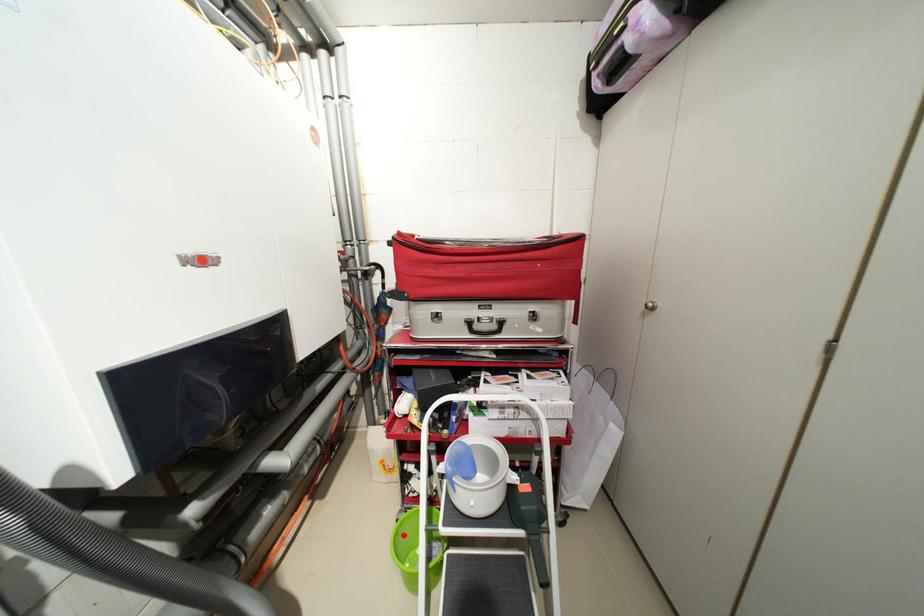
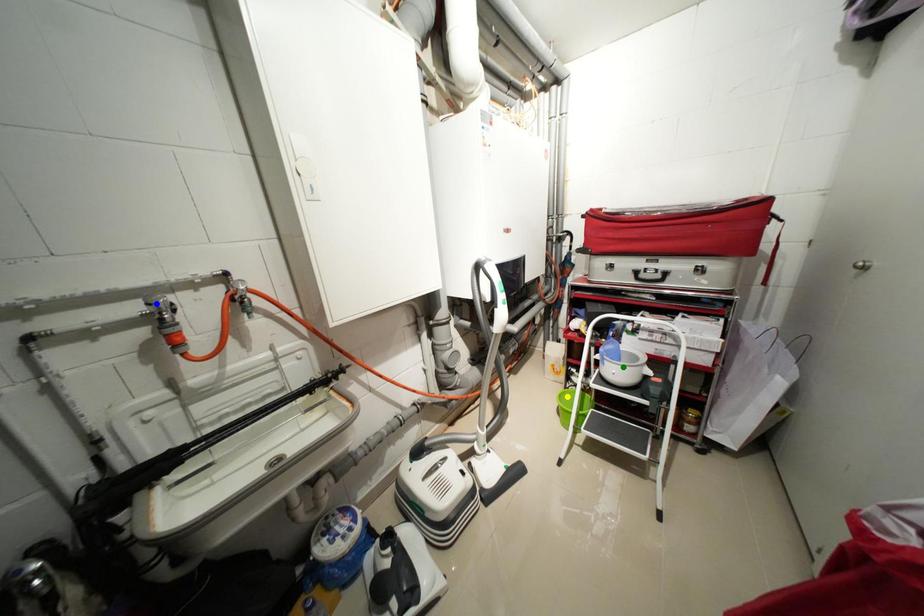
Question: I am providing you with two images of the same scene from different viewpoints. A red point is marked on the first image. You are given multiple points on the second image. Which spot in image 2 lines up with the point in image 1?

Choices:
 (A) yellow point
 (B) green point
 (C) blue point

Answer: (A)